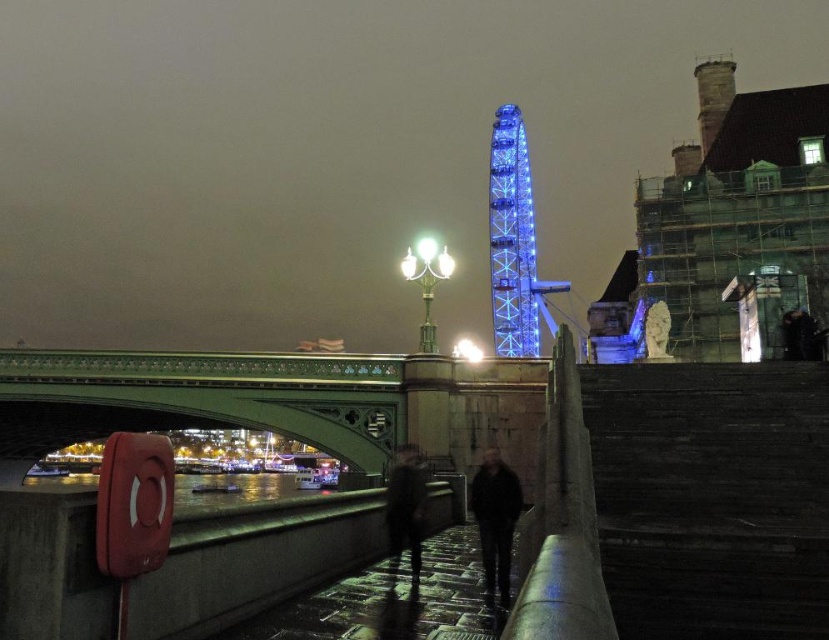
You are an architect reviewing a city model. You notice the green stone bridge at lower left and the blue glass ferris wheel at upper center. Which structure occupies more space in the model?

The green stone bridge at lower left is larger in size than the blue glass ferris wheel at upper center, so it occupies more space in the model.

You are standing on the paved pathway near the red lifebuoy on the left side of the railing. Looking towards the middle ground, where is the blue glass ferris wheel at upper center in relation to the green bridge?

The blue glass ferris wheel at upper center is located at point (514, 243) relative to the green bridge in the middle ground.

You are standing at the red lifebuoy on the left side of the railing and want to take a photo of both point (98, 412) and point (507, 193) in the scene. Which point will appear larger in your camera view?

Point (98, 412) is closer to the camera than point (507, 193), so it will appear larger in the camera view.